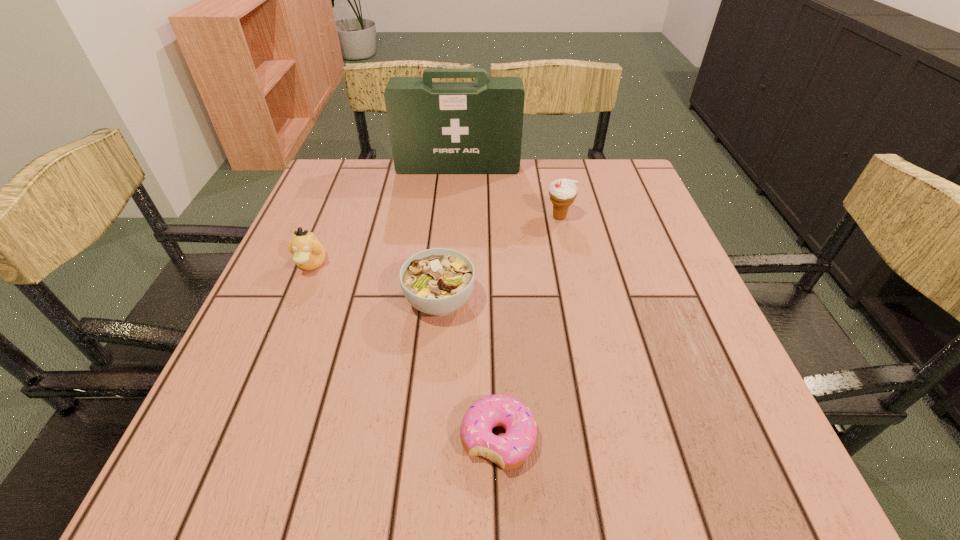
You are a GUI agent. You are given a task and a screenshot of the screen. Output one action in this format:
    pyautogui.click(x=<x>, y=<y>)
    Task: Click on the vacant space located on the left of the rightmost object
    This screenshot has width=960, height=540.
    Given the screenshot: What is the action you would take?
    pyautogui.click(x=453, y=217)

Where is `blank area located on the face of the leftmost object`? This screenshot has height=540, width=960. blank area located on the face of the leftmost object is located at coordinates (282, 335).

This screenshot has width=960, height=540. I want to click on vacant region located on the front of the second shortest object, so click(427, 440).

I want to click on free region located on the back of the nearest object, so click(492, 256).

At what (x,y) coordinates should I click in order to perform the action: click on object that is at the far edge. Please return your answer as a coordinate pair (x, y). This screenshot has width=960, height=540. Looking at the image, I should click on (435, 127).

The height and width of the screenshot is (540, 960). What are the coordinates of `object that is at the near edge` in the screenshot? It's located at (512, 449).

Where is `object at the left edge`? object at the left edge is located at coordinates (309, 254).

In the image, there is a desktop. Identify the location of vacant space at the far edge. The height and width of the screenshot is (540, 960). (393, 162).

Find the location of a particular element. The image size is (960, 540). vacant space at the near edge is located at coordinates (475, 492).

Locate an element on the screen. The image size is (960, 540). free space at the left edge of the desktop is located at coordinates (252, 415).